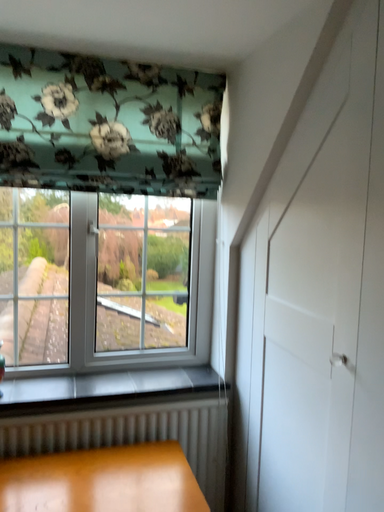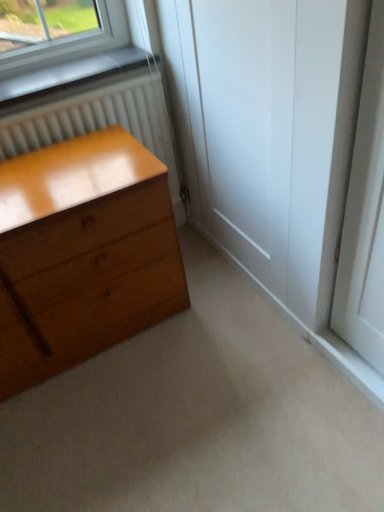
Question: How did the camera likely rotate when shooting the video?

Choices:
 (A) rotated upward
 (B) rotated downward

Answer: (B)